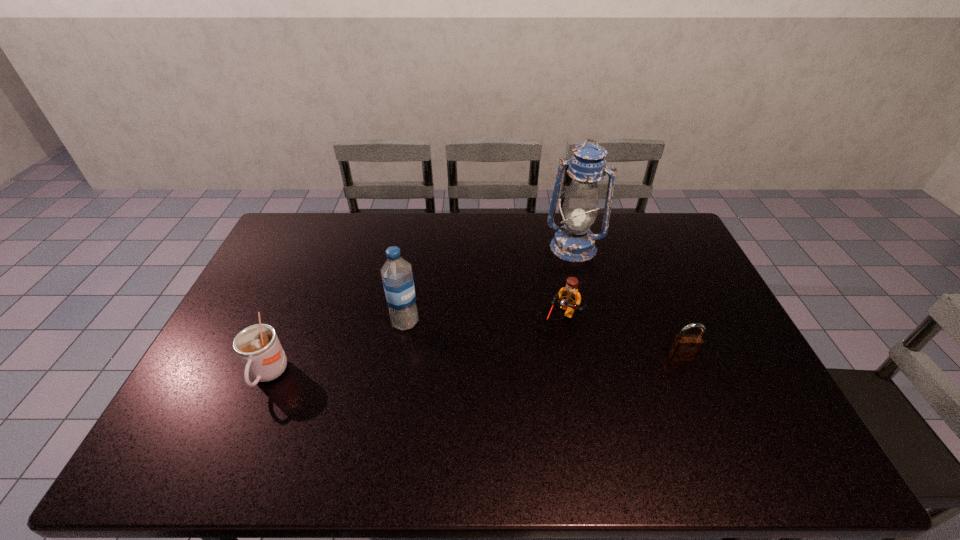
Where is `vacant space located on the label of the second tallest object`? This screenshot has height=540, width=960. vacant space located on the label of the second tallest object is located at coordinates (464, 383).

Identify the location of vacant space situated 0.230m on the label of the second tallest object. The height and width of the screenshot is (540, 960). (461, 381).

Where is `vacant space located 0.260m on the label of the second tallest object`? vacant space located 0.260m on the label of the second tallest object is located at coordinates 468,388.

You are a GUI agent. You are given a task and a screenshot of the screen. Output one action in this format:
    pyautogui.click(x=<x>, y=<y>)
    Task: Click on the vacant space located on the front-facing side of the lantern
    This screenshot has height=540, width=960.
    Given the screenshot: What is the action you would take?
    pyautogui.click(x=563, y=270)

Where is `free location located on the front-facing side of the lantern`? Image resolution: width=960 pixels, height=540 pixels. free location located on the front-facing side of the lantern is located at coordinates (535, 333).

This screenshot has width=960, height=540. What are the coordinates of `vacant region located on the front-facing side of the lantern` in the screenshot? It's located at (537, 331).

I want to click on vacant position located holding a crossbow in the hands of the Lego, so click(523, 375).

Identify the location of vacant space situated 0.170m holding a crossbow in the hands of the Lego. This screenshot has height=540, width=960. (526, 370).

I want to click on vacant area situated holding a crossbow in the hands of the Lego, so click(x=513, y=395).

At what (x,y) coordinates should I click in order to perform the action: click on object that is at the far edge. Please return your answer as a coordinate pair (x, y). The width and height of the screenshot is (960, 540). Looking at the image, I should click on (574, 241).